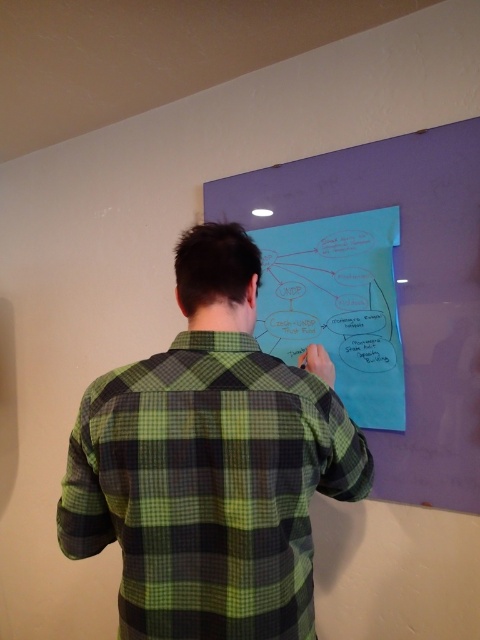
You are an artist who needs to attach a new sketch to the purple board. You have two options for placement based on the existing items. Which object, the blue paperboard at upper center or the blue paper at center, provides more horizontal space for your new sketch?

The blue paperboard at upper center might be wider than blue paper at center, so it likely offers more horizontal space for your new sketch.